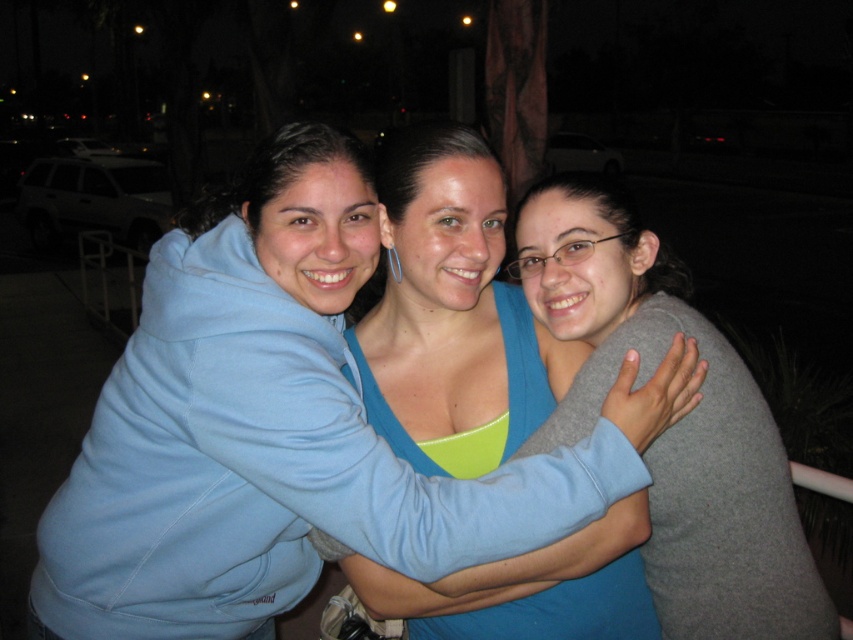
Does blue fabric top at center appear under gray matte sweater at center?

Correct, blue fabric top at center is located below gray matte sweater at center.

Is point (434, 301) farther from viewer compared to point (610, 326)?

No.

The height and width of the screenshot is (640, 853). I want to click on blue fabric top at center, so click(451, 312).